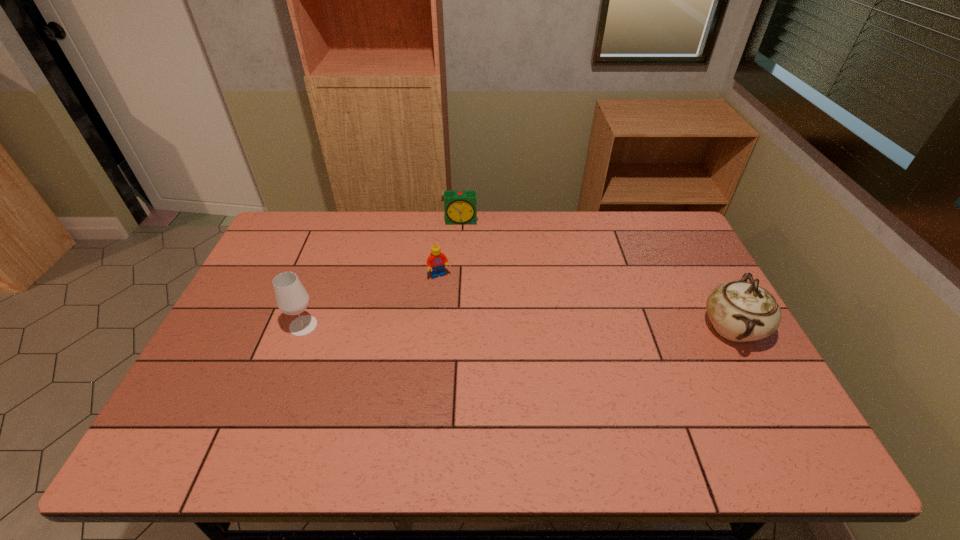
You are a GUI agent. You are given a task and a screenshot of the screen. Output one action in this format:
    pyautogui.click(x=<x>, y=<y>)
    Task: Click on the vacant spot on the desktop that is between the glass and the chinaware and is positioned on the front-facing side of the alarm clock
    
    Given the screenshot: What is the action you would take?
    pyautogui.click(x=459, y=327)

You are a GUI agent. You are given a task and a screenshot of the screen. Output one action in this format:
    pyautogui.click(x=<x>, y=<y>)
    Task: Click on the free spot on the desktop that is between the glass and the rightmost object and is positioned on the face of the third nearest object
    Image resolution: width=960 pixels, height=540 pixels.
    Given the screenshot: What is the action you would take?
    pyautogui.click(x=462, y=327)